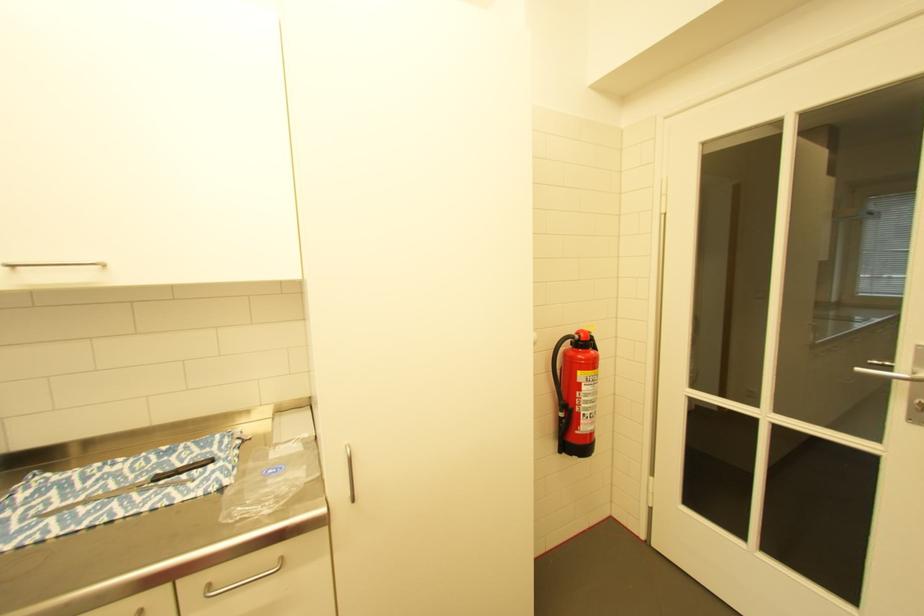
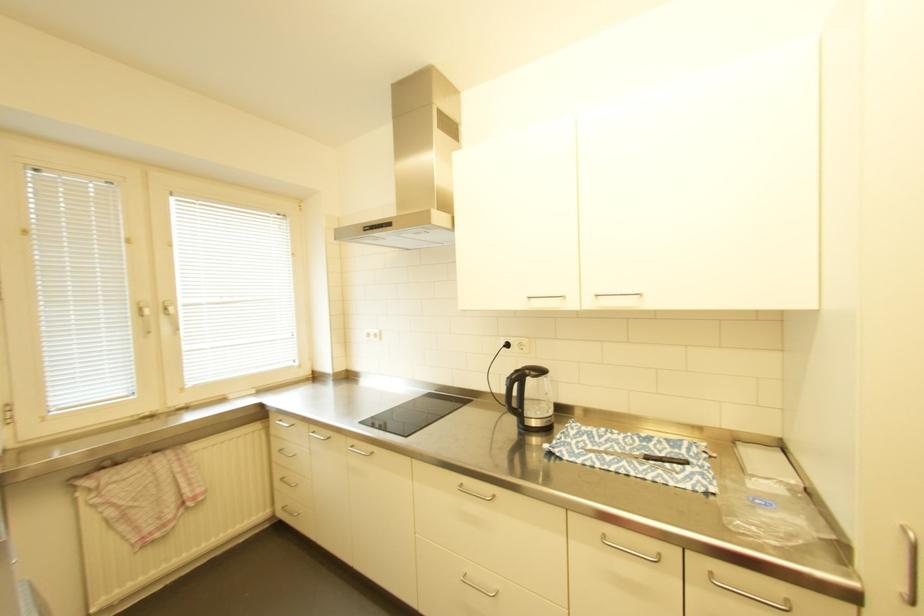
Question: The camera is either moving clockwise (left) or counter-clockwise (right) around the object. The first image is from the beginning of the video and the second image is from the end. Is the camera moving left or right when shooting the video?

Choices:
 (A) Left
 (B) Right

Answer: (B)